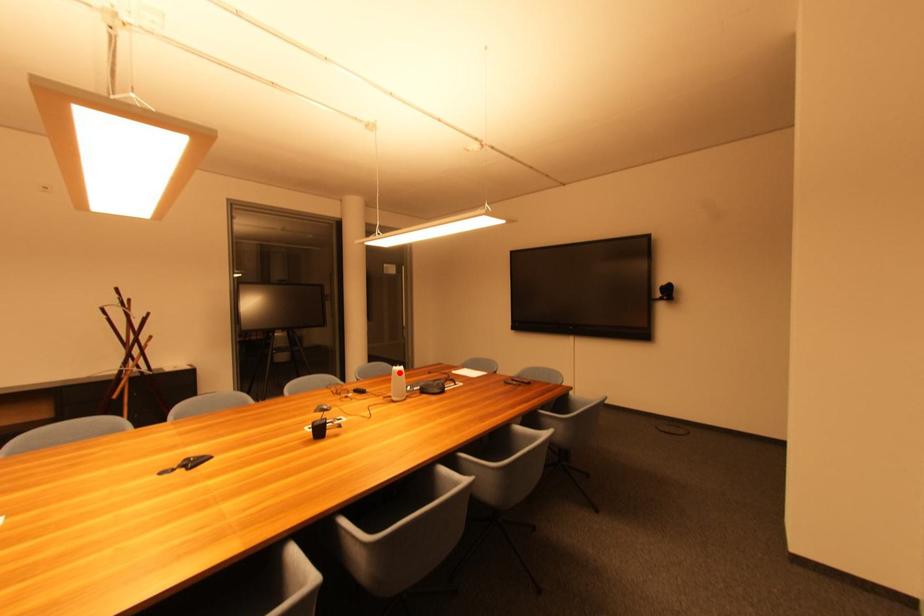
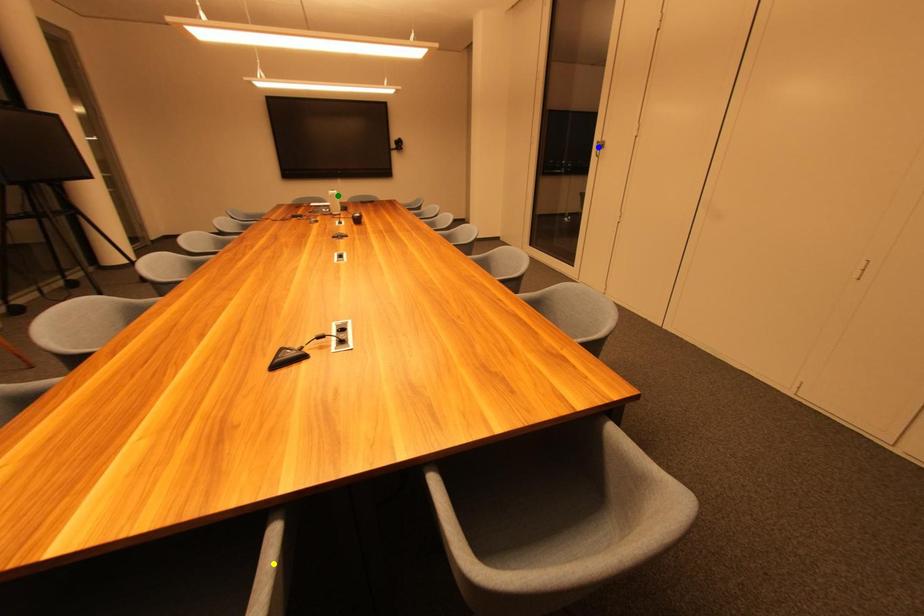
Question: I am providing you with two images of the same scene from different viewpoints. A red point is marked on the first image. You are given multiple points on the second image. Which mark in image 2 goes with the point in image 1?

Choices:
 (A) blue point
 (B) yellow point
 (C) green point

Answer: (C)